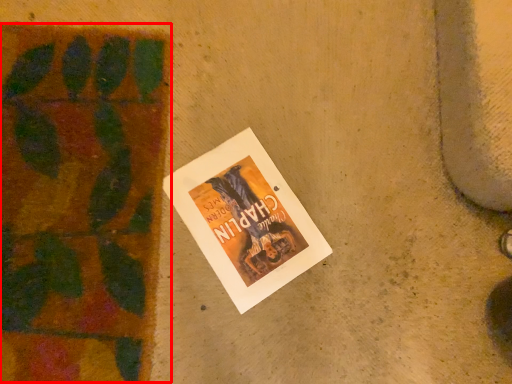
Question: Considering the relative positions of plant (annotated by the red box) and book in the image provided, where is plant (annotated by the red box) located with respect to the staircase?

Choices:
 (A) right
 (B) left

Answer: (B)